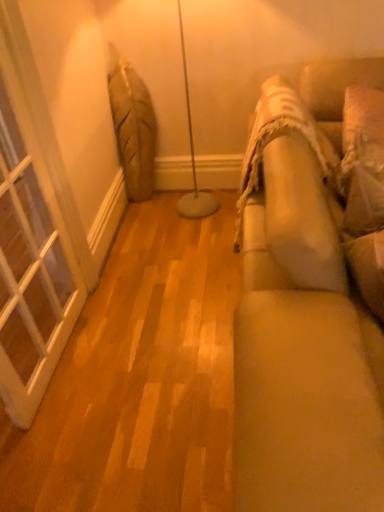
Question: In terms of width, does white textured pillow at right look wider or thinner when compared to beige fabric couch at right?

Choices:
 (A) thin
 (B) wide

Answer: (A)

Question: Looking at the image, does white textured pillow at right seem bigger or smaller compared to beige fabric couch at right?

Choices:
 (A) small
 (B) big

Answer: (A)

Question: Estimate the real-world distances between objects in this image. Which object is farther from the white glass window at left?

Choices:
 (A) beige fabric couch at right
 (B) white textured pillow at right

Answer: (B)

Question: Considering the real-world distances, which object is farthest from the beige fabric couch at right?

Choices:
 (A) white textured pillow at right
 (B) white glass window at left

Answer: (B)